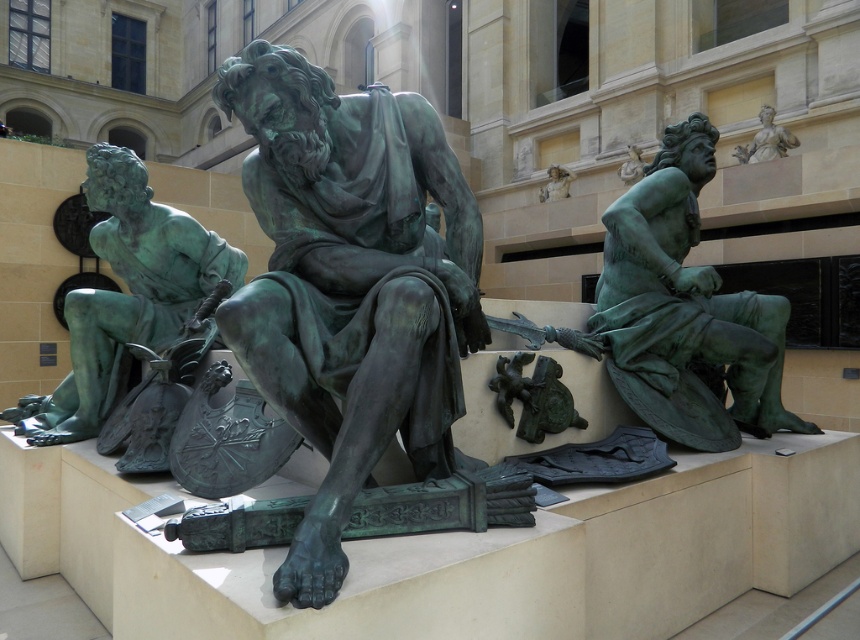
Can you confirm if green patina statue at right is wider than green patina statue at left?

Yes, green patina statue at right is wider than green patina statue at left.

Does point (653, 420) come behind point (158, 268)?

No, (653, 420) is closer to viewer.

You are a GUI agent. You are given a task and a screenshot of the screen. Output one action in this format:
    pyautogui.click(x=<x>, y=<y>)
    Task: Click on the green patina statue at right
    The height and width of the screenshot is (640, 860).
    Given the screenshot: What is the action you would take?
    (x=685, y=310)

The width and height of the screenshot is (860, 640). What are the coordinates of `green patina statue at right` in the screenshot? It's located at (685, 310).

At what (x,y) coordinates should I click in order to perform the action: click on green patina statue at right. Please return your answer as a coordinate pair (x, y). Looking at the image, I should click on (685, 310).

You are a GUI agent. You are given a task and a screenshot of the screen. Output one action in this format:
    pyautogui.click(x=<x>, y=<y>)
    Task: Click on the green patina statue at right
    
    Given the screenshot: What is the action you would take?
    pyautogui.click(x=685, y=310)

This screenshot has width=860, height=640. Describe the element at coordinates (127, 294) in the screenshot. I see `green patina statue at left` at that location.

Is green patina statue at left to the left of green patina statue at upper center from the viewer's perspective?

Correct, you'll find green patina statue at left to the left of green patina statue at upper center.

Is point (129, 253) positioned behind point (566, 170)?

No, (129, 253) is closer to viewer.

At what (x,y) coordinates should I click in order to perform the action: click on green patina statue at left. Please return your answer as a coordinate pair (x, y). Looking at the image, I should click on (127, 294).